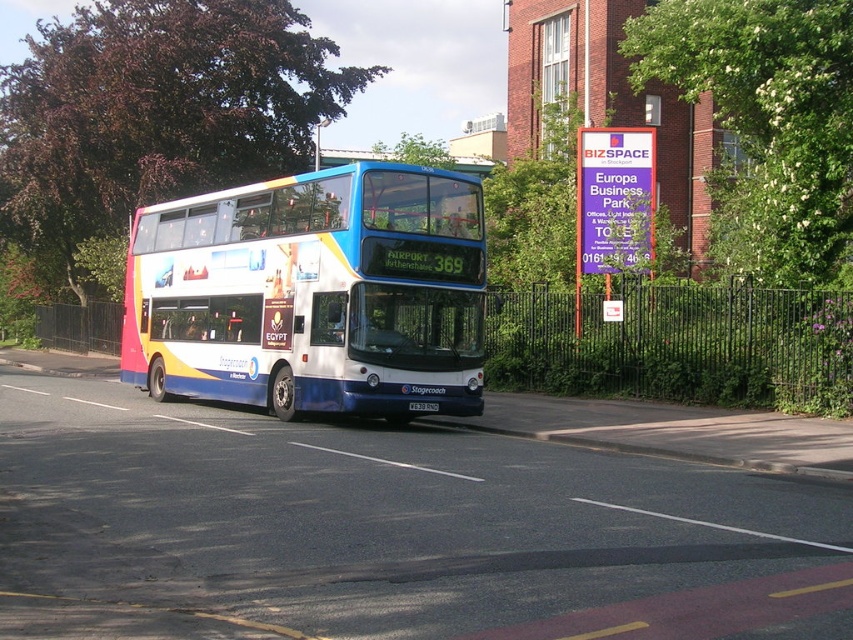
You are a bus driver who needs to check the license plate for a parking permit. The purple sign at upper center and the silver metallic license plate at center are both visible in your rearview mirror. Which object is wider when viewed from your perspective?

The purple sign at upper center is wider than the silver metallic license plate at center, so the purple sign at upper center is wider.

You are standing on the sidewalk next to the road where the Stagecoach bus is traveling. You notice two points marked on the bus. The first is at coordinate point [474,344] and the second is at point [643,152]. Which of these two points do you think is closer to you?

The point at coordinate [474,344] is closer to you than the point at [643,152] because it is positioned nearer in the image.